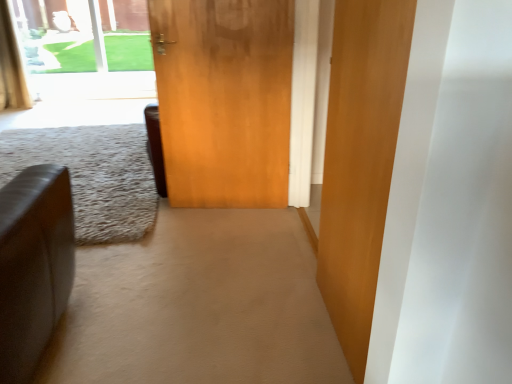
Describe the element at coordinates (92, 175) in the screenshot. Image resolution: width=512 pixels, height=384 pixels. I see `leather couch at left` at that location.

Describe the element at coordinates (56, 35) in the screenshot. The image size is (512, 384). I see `transparent glass window at upper left` at that location.

Image resolution: width=512 pixels, height=384 pixels. I want to click on gold textured curtain at upper left, so click(11, 65).

Based on the photo, what is the approximate height of wooden door at center, the second door positioned from the right?

1.22 meters.

The width and height of the screenshot is (512, 384). Identify the location of leather couch at left. (92, 175).

Choose the correct answer: Is wooden door at center, which is the 1th door in right-to-left order, inside gold textured curtain at upper left or outside it?

wooden door at center, which is the 1th door in right-to-left order, is not enclosed by gold textured curtain at upper left.

From the image's perspective, between wooden door at center, acting as the first door starting from the front, and gold textured curtain at upper left, which one is located above?

gold textured curtain at upper left.

In the scene shown: Is wooden door at center, which is the 1th door in right-to-left order, thinner than gold textured curtain at upper left?

Indeed, wooden door at center, which is the 1th door in right-to-left order, has a lesser width compared to gold textured curtain at upper left.

Can you confirm if wooden door at center, acting as the 2th door starting from the left, is taller than gold textured curtain at upper left?

Yes.

How many degrees apart are the facing directions of leather couch at left and transparent glass window at upper left?

The angular difference between leather couch at left and transparent glass window at upper left is 90.8 degrees.

Is leather couch at left to the left or to the right of transparent glass window at upper left in the image?

Clearly, leather couch at left is on the right of transparent glass window at upper left in the image.

From the picture: Can you confirm if leather couch at left is thinner than transparent glass window at upper left?

Incorrect, the width of leather couch at left is not less than that of transparent glass window at upper left.

Is point (133, 150) closer or farther from the camera than point (80, 48)?

Point (133, 150).

From a real-world perspective, between wooden door at center, acting as the second door starting from the back, and transparent glass window at upper left, who is vertically higher?

transparent glass window at upper left is physically above.

Considering the positions of objects wooden door at center, acting as the second door starting from the back, and transparent glass window at upper left in the image provided, who is more to the right, wooden door at center, acting as the second door starting from the back, or transparent glass window at upper left?

From the viewer's perspective, wooden door at center, acting as the second door starting from the back, appears more on the right side.

Which of these two, wooden door at center, acting as the second door starting from the back, or transparent glass window at upper left, is wider?

transparent glass window at upper left is wider.

Considering the positions of point (376, 9) and point (65, 4), is point (376, 9) closer or farther from the camera than point (65, 4)?

Clearly, point (376, 9) is closer to the camera than point (65, 4).

The image size is (512, 384). In order to click on curtain below the transparent glass window at upper left (from the image's perspective) in this screenshot , I will do `click(11, 65)`.

From the image's perspective, who appears lower, transparent glass window at upper left or gold textured curtain at upper left?

gold textured curtain at upper left, from the image's perspective.

Considering the relative positions of transparent glass window at upper left and gold textured curtain at upper left in the image provided, is transparent glass window at upper left to the right of gold textured curtain at upper left from the viewer's perspective?

Indeed, transparent glass window at upper left is positioned on the right side of gold textured curtain at upper left.

Is transparent glass window at upper left not within gold textured curtain at upper left?

transparent glass window at upper left lies outside gold textured curtain at upper left's area.

Consider the image. Is leather couch at left positioned with its back to wooden door at center, placed as the first door when sorted from back to front?

No, wooden door at center, placed as the first door when sorted from back to front, is not at the back of leather couch at left.

How distant is leather couch at left from wooden door at center, placed as the first door when sorted from back to front?

leather couch at left is 36.02 inches away from wooden door at center, placed as the first door when sorted from back to front.

Is leather couch at left wider or thinner than wooden door at center, placed as the first door when sorted from back to front?

Considering their sizes, leather couch at left looks broader than wooden door at center, placed as the first door when sorted from back to front.

Is leather couch at left at the right side of wooden door at center, placed as the first door when sorted from back to front?

No, leather couch at left is not to the right of wooden door at center, placed as the first door when sorted from back to front.

Is point (131, 37) positioned in front of point (254, 58)?

No.

From a real-world perspective, is transparent glass window at upper left physically located above or below wooden door at center, acting as the 2th door starting from the front?

From a real-world perspective, transparent glass window at upper left is physically above wooden door at center, acting as the 2th door starting from the front.

In the scene shown: Is wooden door at center, the second door positioned from the right, a part of transparent glass window at upper left?

Actually, wooden door at center, the second door positioned from the right, is outside transparent glass window at upper left.

Considering the sizes of objects transparent glass window at upper left and wooden door at center, acting as the 2th door starting from the front, in the image provided, who is shorter, transparent glass window at upper left or wooden door at center, acting as the 2th door starting from the front,?

Standing shorter between the two is transparent glass window at upper left.

Can you tell me how much transparent glass window at upper left and leather couch at left differ in facing direction?

transparent glass window at upper left and leather couch at left are facing 90.8 degrees away from each other.

Considering the positions of objects transparent glass window at upper left and leather couch at left in the image provided, who is more to the right, transparent glass window at upper left or leather couch at left?

Positioned to the right is leather couch at left.

Is transparent glass window at upper left closer to the viewer compared to leather couch at left?

No, transparent glass window at upper left is further to the viewer.

Is leather couch at left inside transparent glass window at upper left?

No, leather couch at left is not inside transparent glass window at upper left.

Identify the location of curtain lying on the left of wooden door at center, acting as the 2th door starting from the left. Image resolution: width=512 pixels, height=384 pixels. click(x=11, y=65).

Identify the location of plain located in front of the transparent glass window at upper left. The width and height of the screenshot is (512, 384). (92, 175).

Looking at the image, which one is located closer to wooden door at center, which is the 1th door in right-to-left order, gold textured curtain at upper left or transparent glass window at upper left?

The object closer to wooden door at center, which is the 1th door in right-to-left order, is transparent glass window at upper left.

From the image, which object appears to be nearer to leather couch at left, wooden door at center, acting as the 2th door starting from the left, or wooden door at center, placed as the first door when sorted from back to front?

wooden door at center, placed as the first door when sorted from back to front, is positioned closer to the anchor leather couch at left.

From the picture: Looking at the image, which one is located further to wooden door at center, which is the 1th door in right-to-left order, leather couch at left or gold textured curtain at upper left?

Among the two, gold textured curtain at upper left is located further to wooden door at center, which is the 1th door in right-to-left order.

Considering their positions, is gold textured curtain at upper left positioned further to transparent glass window at upper left than wooden door at center, acting as the 2th door starting from the front?

wooden door at center, acting as the 2th door starting from the front, is further to transparent glass window at upper left.

From the image, which object appears to be farther from gold textured curtain at upper left, leather couch at left or wooden door at center, acting as the 2th door starting from the front?

Among the two, wooden door at center, acting as the 2th door starting from the front, is located further to gold textured curtain at upper left.

Based on their spatial positions, is wooden door at center, acting as the 2th door starting from the front, or wooden door at center, acting as the 2th door starting from the left, closer to leather couch at left?

wooden door at center, acting as the 2th door starting from the front, is closer to leather couch at left.

Which object lies further to the anchor point transparent glass window at upper left, gold textured curtain at upper left or wooden door at center, acting as the 2th door starting from the left?

wooden door at center, acting as the 2th door starting from the left, is positioned further to the anchor transparent glass window at upper left.

Which object lies nearer to the anchor point gold textured curtain at upper left, wooden door at center, placed as the first door when sorted from back to front, or wooden door at center, acting as the second door starting from the back?

Based on the image, wooden door at center, placed as the first door when sorted from back to front, appears to be nearer to gold textured curtain at upper left.

Find the location of a particular element. door between wooden door at center, acting as the 2th door starting from the left, and transparent glass window at upper left in the front-back direction is located at coordinates (224, 100).

The height and width of the screenshot is (384, 512). I want to click on curtain located between leather couch at left and transparent glass window at upper left in the depth direction, so click(11, 65).

The image size is (512, 384). What are the coordinates of `plain between wooden door at center, acting as the second door starting from the back, and transparent glass window at upper left in the front-back direction` in the screenshot? It's located at (92, 175).

This screenshot has width=512, height=384. Identify the location of curtain between wooden door at center, placed as the 1th door when sorted from left to right, and transparent glass window at upper left from front to back. (11, 65).